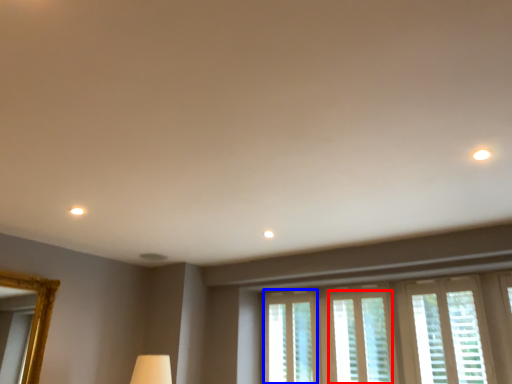
Question: Which point is further to the camera, window (highlighted by a red box) or window (highlighted by a blue box)?

Choices:
 (A) window
 (B) window

Answer: (B)